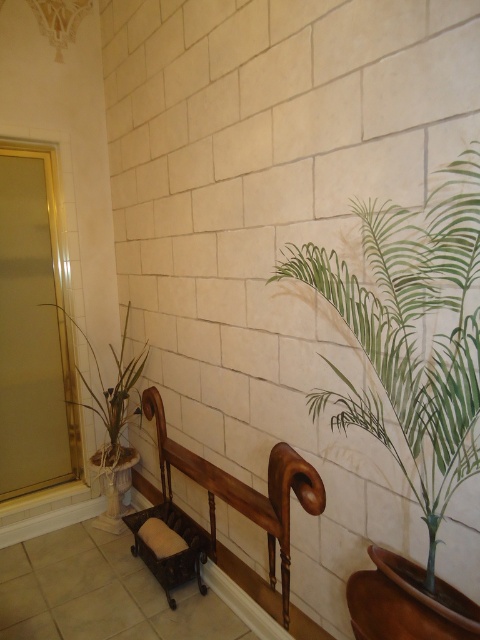
You are a houseplant delivery person who just arrived at a modern bathroom. You need to place a new green leafy plant at right in the room. The delivery robot can only reach up to 40 inches. Will the robot be able to place the plant at the correct location?

The green leafy plant at right is 39.09 inches from the camera, which is within the robot delivery robot can reach up to 40 inches. Therefore, the robot can place the plant at the correct location.

You are standing in a bathroom and want to reach a point that is 1.46 meters away from you. The point is located at coordinates point (345,408). Can you estimate whether you can comfortably reach that point without moving your feet?

The distance between you and point (345,408) is 1.46 meters. Since the average comfortable reaching distance for an adult without moving feet is about 1 meter, you might need to take a step forward to comfortably reach the point.